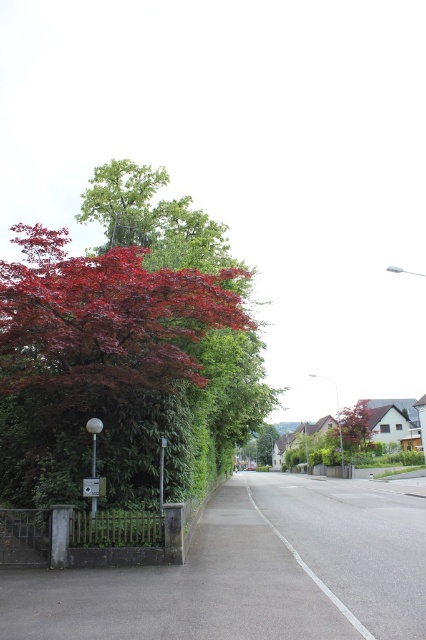
Which is more to the right, glossy red maple tree at left or smooth red tree at right?

From the viewer's perspective, smooth red tree at right appears more on the right side.

Between glossy red maple tree at left and smooth red tree at right, which one has less height?

smooth red tree at right

Find the location of `glossy red maple tree at left`. glossy red maple tree at left is located at coordinates (100, 364).

Does glossy red maple tree at left have a smaller size compared to metallic gray street sign at lower left?

Actually, glossy red maple tree at left might be larger than metallic gray street sign at lower left.

Is glossy red maple tree at left shorter than metallic gray street sign at lower left?

No.

Between point (150, 464) and point (89, 477), which one is positioned behind?

The point (150, 464) is behind.

The width and height of the screenshot is (426, 640). Find the location of `glossy red maple tree at left`. glossy red maple tree at left is located at coordinates (100, 364).

Which is more to the right, smooth red tree at right or metallic gray street sign at lower left?

smooth red tree at right

Which is in front, point (348, 428) or point (100, 481)?

Point (100, 481) is more forward.

At what (x,y) coordinates should I click in order to perform the action: click on smooth red tree at right. Please return your answer as a coordinate pair (x, y). Image resolution: width=426 pixels, height=640 pixels. Looking at the image, I should click on (351, 429).